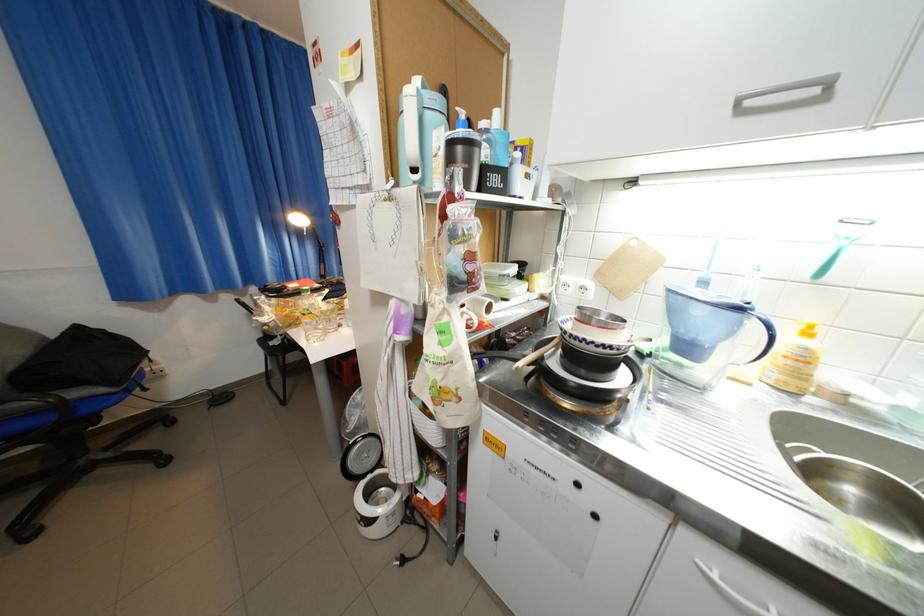
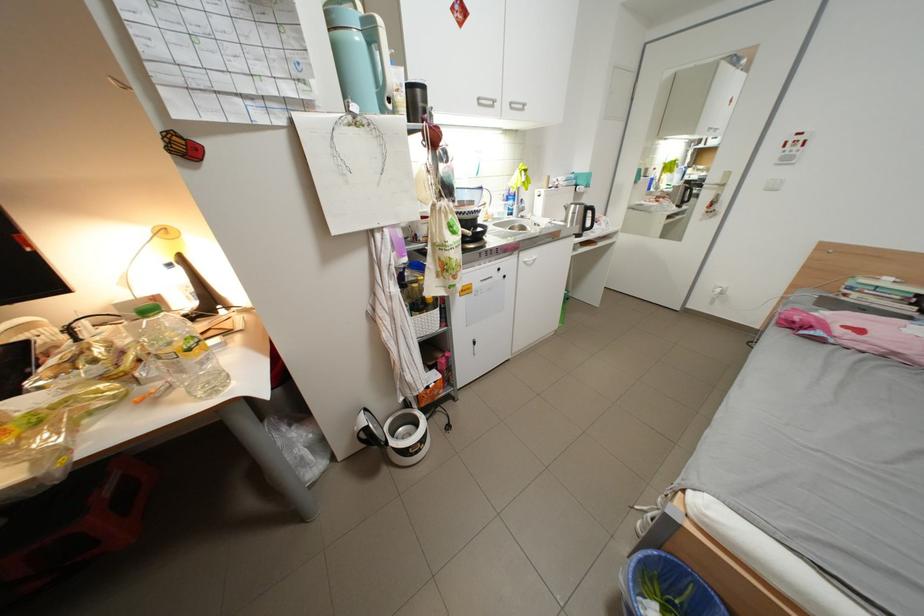
Where in the second image is the point corresponding to point 373,485 from the first image?

(404, 444)